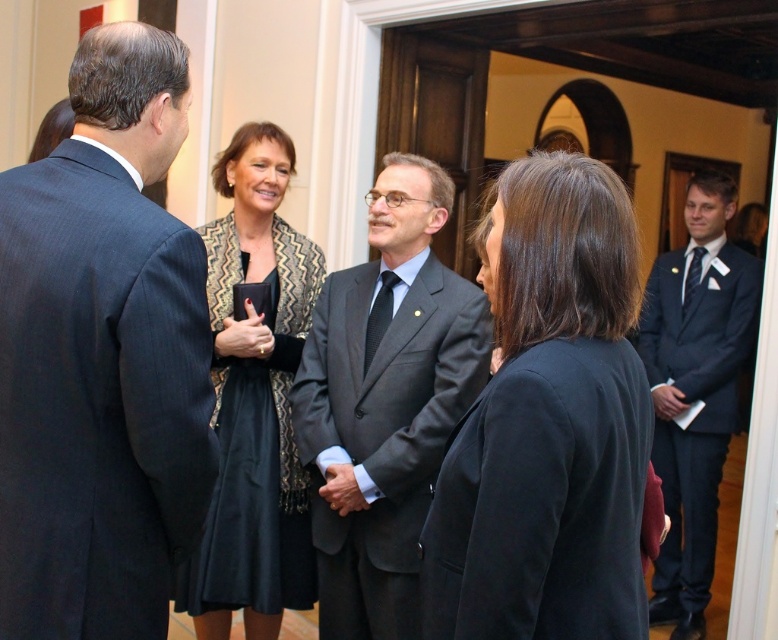
You are standing in the room and want to hand a document to both the patterned fabric dress at center and the dark blue suit at right. Which person should you approach first based on their proximity to you?

You should approach the patterned fabric dress at center first because it is closer to you than the dark blue suit at right.

You are an event planner arranging seating for a photo. You need to place the patterned fabric dress at center and dark blue suit at right in a row. Which object should be placed first if you want the shorter one closer to the camera?

The patterned fabric dress at center is shorter than the dark blue suit at right, so it should be placed first closer to the camera.